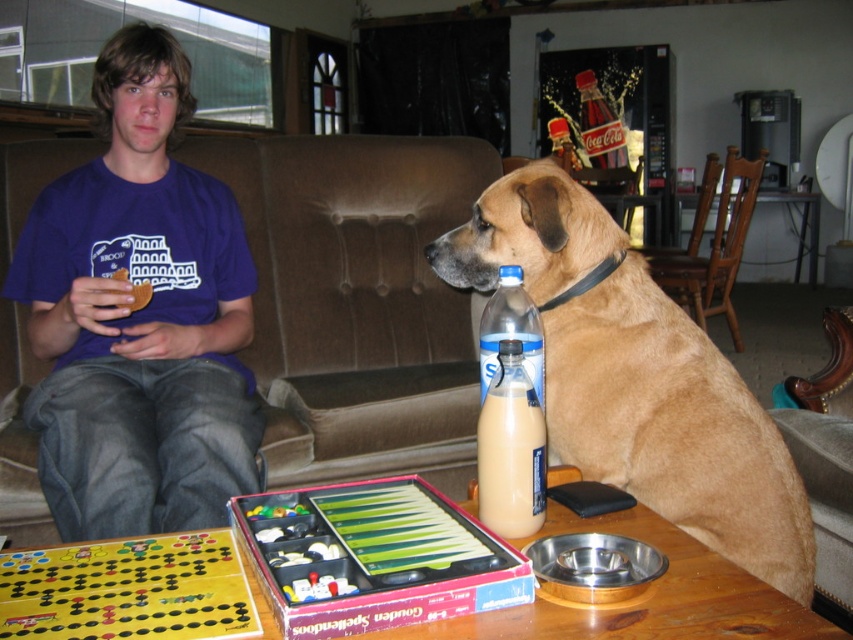
The image size is (853, 640). Describe the element at coordinates (357, 300) in the screenshot. I see `brown fabric couch at left` at that location.

Which is more to the right, brown fabric couch at left or wooden table at center?

Positioned to the right is wooden table at center.

Between point (421, 285) and point (700, 628), which one is positioned behind?

The point (421, 285) is more distant.

The image size is (853, 640). In order to click on brown fabric couch at left in this screenshot , I will do `click(357, 300)`.

Which is behind, point (283, 416) or point (495, 474)?

Positioned behind is point (283, 416).

Which of these two, brown fabric couch at left or milky white plastic bottle at center, stands shorter?

milky white plastic bottle at center

Is point (439, 307) in front of point (503, 483)?

That is False.

Locate an element on the screen. brown fabric couch at left is located at coordinates (357, 300).

Does blue t-shirt at center appear over brown fur dog at center?

Yes, blue t-shirt at center is above brown fur dog at center.

Is blue t-shirt at center below brown fur dog at center?

Incorrect, blue t-shirt at center is not positioned below brown fur dog at center.

You are a GUI agent. You are given a task and a screenshot of the screen. Output one action in this format:
    pyautogui.click(x=<x>, y=<y>)
    Task: Click on the blue t-shirt at center
    This screenshot has height=640, width=853.
    Given the screenshot: What is the action you would take?
    pyautogui.click(x=138, y=317)